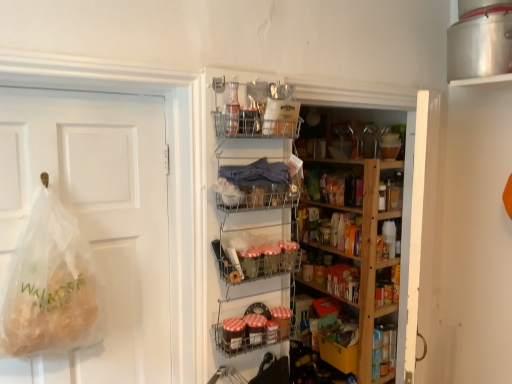
Question: Considering the relative sizes of metallic wire baskets at lower center, positioned as the first shelf in bottom-to-top order, and metallic wire basket at center, the third shelf viewed from the top, in the image provided, is metallic wire baskets at lower center, positioned as the first shelf in bottom-to-top order, bigger than metallic wire basket at center, the third shelf viewed from the top,?

Choices:
 (A) yes
 (B) no

Answer: (A)

Question: Can you confirm if metallic wire baskets at lower center, which is counted as the 5th shelf, starting from the top, is thinner than metallic wire basket at center, which is counted as the third shelf, starting from the bottom?

Choices:
 (A) no
 (B) yes

Answer: (B)

Question: Considering the relative sizes of metallic wire baskets at lower center, positioned as the first shelf in bottom-to-top order, and metallic wire basket at center, which is counted as the third shelf, starting from the bottom, in the image provided, is metallic wire baskets at lower center, positioned as the first shelf in bottom-to-top order, smaller than metallic wire basket at center, which is counted as the third shelf, starting from the bottom,?

Choices:
 (A) yes
 (B) no

Answer: (B)

Question: Can you confirm if metallic wire baskets at lower center, which is counted as the 5th shelf, starting from the top, is taller than metallic wire basket at center, which is counted as the third shelf, starting from the bottom?

Choices:
 (A) yes
 (B) no

Answer: (A)

Question: From a real-world perspective, is metallic wire baskets at lower center, which is counted as the 5th shelf, starting from the top, on metallic wire basket at center, the third shelf viewed from the top?

Choices:
 (A) yes
 (B) no

Answer: (B)

Question: Considering the relative sizes of metallic wire baskets at lower center, positioned as the first shelf in bottom-to-top order, and metallic wire basket at center, which is counted as the third shelf, starting from the bottom, in the image provided, is metallic wire baskets at lower center, positioned as the first shelf in bottom-to-top order, wider than metallic wire basket at center, which is counted as the third shelf, starting from the bottom,?

Choices:
 (A) yes
 (B) no

Answer: (B)

Question: Are translucent plastic bag at left and metallic wire basket at center, which is the 2th shelf in top-to-bottom order, making contact?

Choices:
 (A) yes
 (B) no

Answer: (B)

Question: From a real-world perspective, is translucent plastic bag at left physically above metallic wire basket at center, acting as the 4th shelf starting from the bottom?

Choices:
 (A) no
 (B) yes

Answer: (A)

Question: Can you confirm if translucent plastic bag at left is taller than metallic wire basket at center, which is the 2th shelf in top-to-bottom order?

Choices:
 (A) yes
 (B) no

Answer: (A)

Question: Is translucent plastic bag at left thinner than metallic wire basket at center, which is the 2th shelf in top-to-bottom order?

Choices:
 (A) no
 (B) yes

Answer: (A)

Question: Can you confirm if translucent plastic bag at left is positioned to the right of metallic wire basket at center, which is the 2th shelf in top-to-bottom order?

Choices:
 (A) yes
 (B) no

Answer: (B)

Question: Is translucent plastic bag at left to the left of metallic wire basket at center, acting as the 4th shelf starting from the bottom, from the viewer's perspective?

Choices:
 (A) no
 (B) yes

Answer: (B)

Question: From the image's perspective, is metallic wire basket at center, which is counted as the third shelf, starting from the bottom, over wooden shelves at center, the fourth shelf in the top-to-bottom sequence?

Choices:
 (A) yes
 (B) no

Answer: (A)